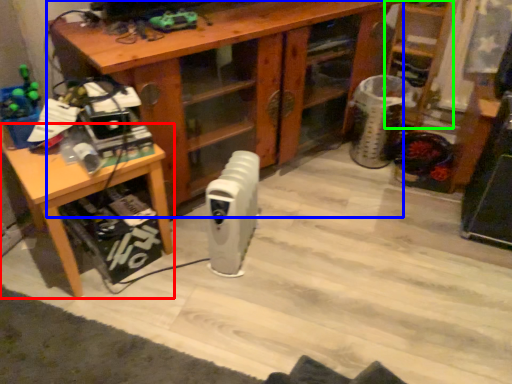
Question: Which is nearer to the table (highlighted by a red box)? desk (highlighted by a blue box) or shelf (highlighted by a green box).

Choices:
 (A) desk
 (B) shelf

Answer: (A)